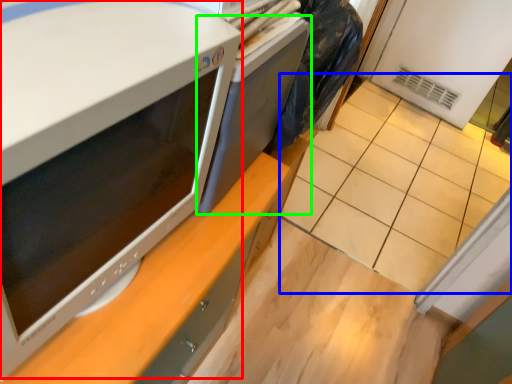
Question: Considering the real-world distances, which object is closest to home appliance (highlighted by a red box)? tile (highlighted by a blue box) or desktop (highlighted by a green box).

Choices:
 (A) tile
 (B) desktop

Answer: (B)